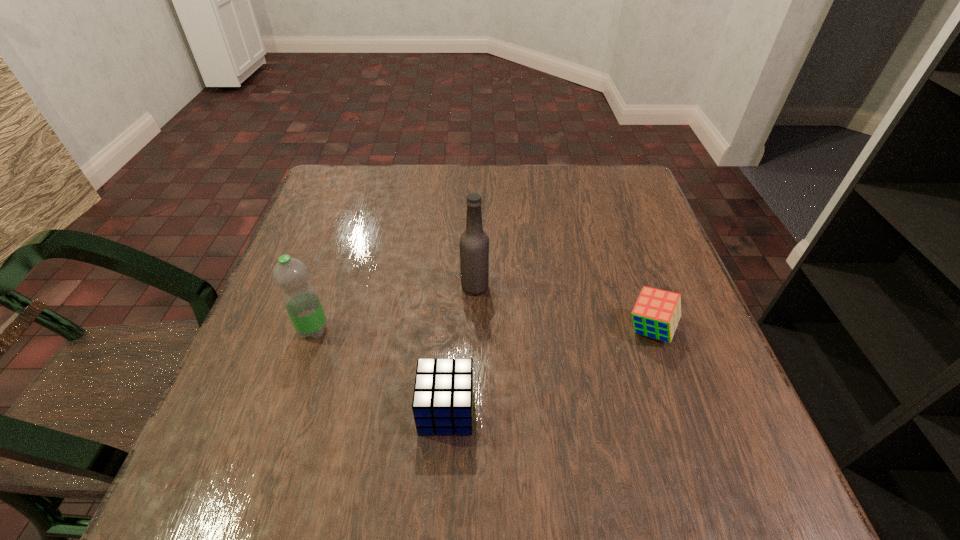
You are a GUI agent. You are given a task and a screenshot of the screen. Output one action in this format:
    pyautogui.click(x=<x>, y=<y>)
    Task: Click on the blank region between the beer bottle and the right cube
    The width and height of the screenshot is (960, 540).
    Given the screenshot: What is the action you would take?
    pyautogui.click(x=563, y=308)

Where is `unoccupied area between the farthest object and the right cube`? The height and width of the screenshot is (540, 960). unoccupied area between the farthest object and the right cube is located at coordinates (563, 308).

This screenshot has width=960, height=540. I want to click on empty location between the farther cube and the nearer cube, so click(x=548, y=370).

Where is `free spot between the second tallest object and the right cube`? This screenshot has width=960, height=540. free spot between the second tallest object and the right cube is located at coordinates (482, 330).

Locate an element on the screen. The image size is (960, 540). unoccupied area between the beer bottle and the farther cube is located at coordinates (563, 308).

Where is `vacant space in between the nearer cube and the leftmost object`? The height and width of the screenshot is (540, 960). vacant space in between the nearer cube and the leftmost object is located at coordinates (380, 370).

You are a GUI agent. You are given a task and a screenshot of the screen. Output one action in this format:
    pyautogui.click(x=<x>, y=<y>)
    Task: Click on the blank region between the farther cube and the leftmost object
    
    Given the screenshot: What is the action you would take?
    pyautogui.click(x=482, y=330)

Identify the location of empty space that is in between the right cube and the beer bottle. The height and width of the screenshot is (540, 960). (563, 308).

What are the coordinates of `free area in between the leftmost object and the farthest object` in the screenshot? It's located at (395, 308).

Where is `vacant point located between the beer bottle and the farther cube`? This screenshot has width=960, height=540. vacant point located between the beer bottle and the farther cube is located at coordinates (563, 308).